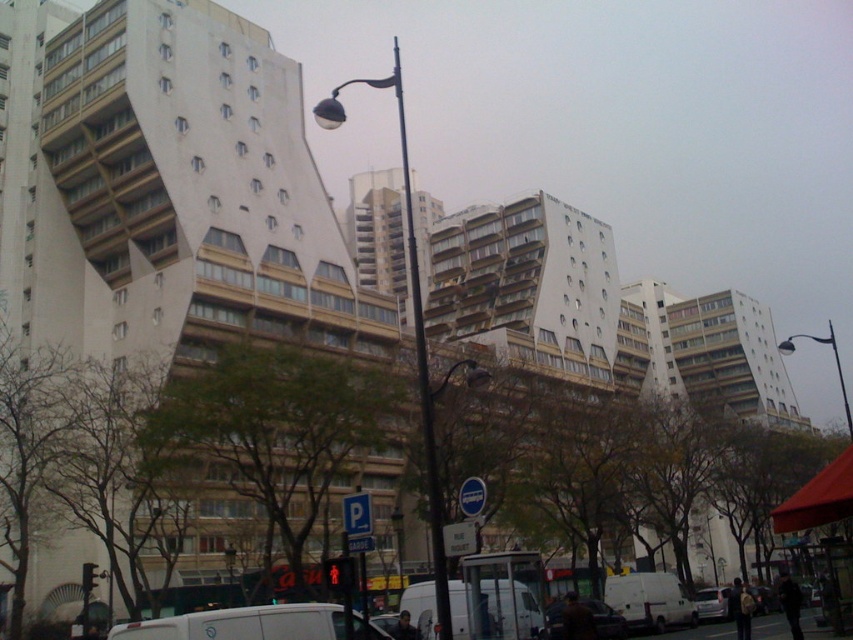
You are a photographer trying to capture the matte black street light at center and the silver metallic van at lower right in the same frame. Based on their sizes in the image, which object would appear bigger in your photo?

The matte black street light at center appears bigger in the photo because its width is larger than that of the silver metallic van at lower right.

You are a pedestrian standing at the edge of the road looking towards the matte black street light at center and the silver metallic van at lower right. Which object is closer to you?

The matte black street light at center is closer to you since it is positioned in front of the silver metallic van at lower right.